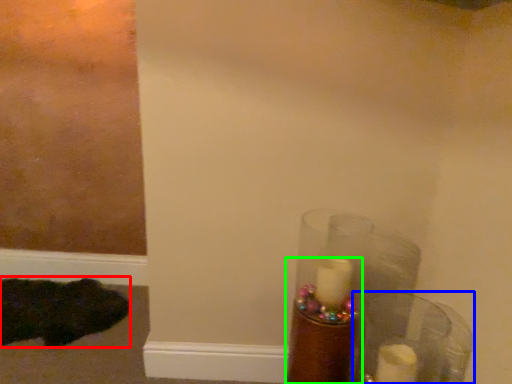
Question: Which is nearer to the animal (highlighted by a red box)? glass vase (highlighted by a blue box) or candle holder (highlighted by a green box).

Choices:
 (A) glass vase
 (B) candle holder

Answer: (B)